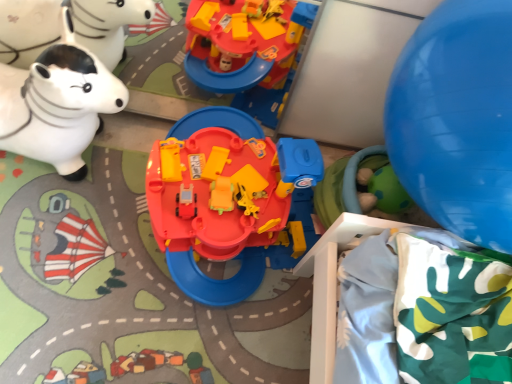
Consider the image. How much space does white glossy rocking horse at left, acting as the 1th toy starting from the left, occupy horizontally?

white glossy rocking horse at left, acting as the 1th toy starting from the left, is 19.89 inches in width.

At what (x,y) coordinates should I click in order to perform the action: click on white glossy rocking horse at left, arranged as the third toy when viewed from the right. Please return your answer as a coordinate pair (x, y). The width and height of the screenshot is (512, 384). Looking at the image, I should click on (58, 103).

Which object is positioned more to the left, white glossy rocking horse at left, acting as the 1th toy starting from the left, or green rubber ball at lower right, which is the first toy from right to left?

white glossy rocking horse at left, acting as the 1th toy starting from the left, is more to the left.

Can you see white glossy rocking horse at left, arranged as the third toy when viewed from the right, touching green rubber ball at lower right, which is the first toy from right to left?

white glossy rocking horse at left, arranged as the third toy when viewed from the right, and green rubber ball at lower right, which is the first toy from right to left, are clearly separated.

Considering the positions of objects white glossy rocking horse at left, arranged as the third toy when viewed from the right, and green rubber ball at lower right, positioned as the third toy in left-to-right order, in the image provided, who is behind, white glossy rocking horse at left, arranged as the third toy when viewed from the right, or green rubber ball at lower right, positioned as the third toy in left-to-right order,?

green rubber ball at lower right, positioned as the third toy in left-to-right order, is more distant.

From the picture: Can you confirm if white glossy rocking horse at left, arranged as the third toy when viewed from the right, is shorter than green rubber ball at lower right, which is the first toy from right to left?

No.

Between blue rubber balloon at right and green rubber ball at lower right, positioned as the third toy in left-to-right order, which one has larger width?

blue rubber balloon at right is wider.

From the image's perspective, which is below, blue rubber balloon at right or green rubber ball at lower right, which is the first toy from right to left?

From the image's view, green rubber ball at lower right, which is the first toy from right to left, is below.

Is blue rubber balloon at right positioned far away from green rubber ball at lower right, which is the first toy from right to left?

blue rubber balloon at right is actually quite close to green rubber ball at lower right, which is the first toy from right to left.

Based on the photo, is green rubber ball at lower right, which is the first toy from right to left, at the back of blue rubber balloon at right?

blue rubber balloon at right does not have its back to green rubber ball at lower right, which is the first toy from right to left.

Considering the sizes of objects blue rubber balloon at right and matte plastic playset at center, which ranks as the 2th toy in left-to-right order, in the image provided, who is smaller, blue rubber balloon at right or matte plastic playset at center, which ranks as the 2th toy in left-to-right order,?

Smaller between the two is matte plastic playset at center, which ranks as the 2th toy in left-to-right order.

Is blue rubber balloon at right outside of matte plastic playset at center, which ranks as the 2th toy in left-to-right order?

Yes.

From the image's perspective, is blue rubber balloon at right above matte plastic playset at center, positioned as the second toy in right-to-left order?

Yes, from the image's perspective, blue rubber balloon at right is over matte plastic playset at center, positioned as the second toy in right-to-left order.

Can you confirm if blue rubber balloon at right is shorter than matte plastic playset at center, which ranks as the 2th toy in left-to-right order?

Incorrect, the height of blue rubber balloon at right does not fall short of that of matte plastic playset at center, which ranks as the 2th toy in left-to-right order.

From a real-world perspective, which is physically below, blue rubber balloon at right or white glossy rocking horse at left, arranged as the third toy when viewed from the right?

white glossy rocking horse at left, arranged as the third toy when viewed from the right, is physically lower.

Can you see blue rubber balloon at right touching white glossy rocking horse at left, arranged as the third toy when viewed from the right?

No, blue rubber balloon at right is not making contact with white glossy rocking horse at left, arranged as the third toy when viewed from the right.

The height and width of the screenshot is (384, 512). Identify the location of toy lying above the blue rubber balloon at right (from the image's perspective). (58, 103).

Is blue rubber balloon at right located within white glossy rocking horse at left, arranged as the third toy when viewed from the right?

Actually, blue rubber balloon at right is outside white glossy rocking horse at left, arranged as the third toy when viewed from the right.

From a real-world perspective, is white glossy rocking horse at left, arranged as the third toy when viewed from the right, above or below blue rubber balloon at right?

In terms of real-world spatial position, white glossy rocking horse at left, arranged as the third toy when viewed from the right, is below blue rubber balloon at right.

Which object is thinner, white glossy rocking horse at left, arranged as the third toy when viewed from the right, or blue rubber balloon at right?

Thinner between the two is blue rubber balloon at right.

Looking at this image, who is more distant, white glossy rocking horse at left, arranged as the third toy when viewed from the right, or blue rubber balloon at right?

Positioned behind is white glossy rocking horse at left, arranged as the third toy when viewed from the right.

Which is more to the left, white glossy rocking horse at left, acting as the 1th toy starting from the left, or matte plastic playset at center, positioned as the second toy in right-to-left order?

white glossy rocking horse at left, acting as the 1th toy starting from the left, is more to the left.

From the image's perspective, count 2nd toys downward from the white glossy rocking horse at left, acting as the 1th toy starting from the left, and point to it. Please provide its 2D coordinates.

[(229, 200)]

Could you tell me if white glossy rocking horse at left, acting as the 1th toy starting from the left, is facing matte plastic playset at center, which ranks as the 2th toy in left-to-right order?

Yes, white glossy rocking horse at left, acting as the 1th toy starting from the left, is aimed at matte plastic playset at center, which ranks as the 2th toy in left-to-right order.

Consider the image. Is green rubber ball at lower right, which is the first toy from right to left, positioned far away from blue rubber balloon at right?

No.

Consider the image. From the image's perspective, is green rubber ball at lower right, positioned as the third toy in left-to-right order, positioned above or below blue rubber balloon at right?

From the image's perspective, green rubber ball at lower right, positioned as the third toy in left-to-right order, appears below blue rubber balloon at right.

In the scene shown: Considering the relative sizes of green rubber ball at lower right, positioned as the third toy in left-to-right order, and blue rubber balloon at right in the image provided, is green rubber ball at lower right, positioned as the third toy in left-to-right order, wider than blue rubber balloon at right?

No.

The height and width of the screenshot is (384, 512). What are the coordinates of `the 1st toy in front when counting from the green rubber ball at lower right, positioned as the third toy in left-to-right order` in the screenshot? It's located at (58, 103).

Find the location of a particular element. This screenshot has width=512, height=384. balloon that is above the green rubber ball at lower right, which is the first toy from right to left (from a real-world perspective) is located at coordinates [457, 120].

From the image, which object appears to be nearer to white glossy rocking horse at left, arranged as the third toy when viewed from the right, matte plastic playset at center, which ranks as the 2th toy in left-to-right order, or green rubber ball at lower right, which is the first toy from right to left?

matte plastic playset at center, which ranks as the 2th toy in left-to-right order.

Looking at the image, which one is located further to blue rubber balloon at right, green rubber ball at lower right, positioned as the third toy in left-to-right order, or matte plastic playset at center, positioned as the second toy in right-to-left order?

green rubber ball at lower right, positioned as the third toy in left-to-right order, lies further to blue rubber balloon at right than the other object.

From the image, which object appears to be farther from blue rubber balloon at right, white glossy rocking horse at left, acting as the 1th toy starting from the left, or green rubber ball at lower right, positioned as the third toy in left-to-right order?

white glossy rocking horse at left, acting as the 1th toy starting from the left, is further to blue rubber balloon at right.

From the picture: Which object lies further to the anchor point blue rubber balloon at right, green rubber ball at lower right, positioned as the third toy in left-to-right order, or white glossy rocking horse at left, acting as the 1th toy starting from the left?

white glossy rocking horse at left, acting as the 1th toy starting from the left, lies further to blue rubber balloon at right than the other object.

From the picture: When comparing their distances from white glossy rocking horse at left, arranged as the third toy when viewed from the right, does blue rubber balloon at right or matte plastic playset at center, which ranks as the 2th toy in left-to-right order, seem further?

Among the two, blue rubber balloon at right is located further to white glossy rocking horse at left, arranged as the third toy when viewed from the right.

Estimate the real-world distances between objects in this image. Which object is further from green rubber ball at lower right, which is the first toy from right to left, matte plastic playset at center, which ranks as the 2th toy in left-to-right order, or white glossy rocking horse at left, acting as the 1th toy starting from the left?

white glossy rocking horse at left, acting as the 1th toy starting from the left.

Based on their spatial positions, is blue rubber balloon at right or white glossy rocking horse at left, arranged as the third toy when viewed from the right, closer to green rubber ball at lower right, positioned as the third toy in left-to-right order?

The object closer to green rubber ball at lower right, positioned as the third toy in left-to-right order, is blue rubber balloon at right.

Estimate the real-world distances between objects in this image. Which object is further from blue rubber balloon at right, matte plastic playset at center, positioned as the second toy in right-to-left order, or white glossy rocking horse at left, arranged as the third toy when viewed from the right?

Among the two, white glossy rocking horse at left, arranged as the third toy when viewed from the right, is located further to blue rubber balloon at right.

This screenshot has width=512, height=384. Find the location of `toy between white glossy rocking horse at left, acting as the 1th toy starting from the left, and green rubber ball at lower right, which is the first toy from right to left, in the horizontal direction`. toy between white glossy rocking horse at left, acting as the 1th toy starting from the left, and green rubber ball at lower right, which is the first toy from right to left, in the horizontal direction is located at coordinates (229, 200).